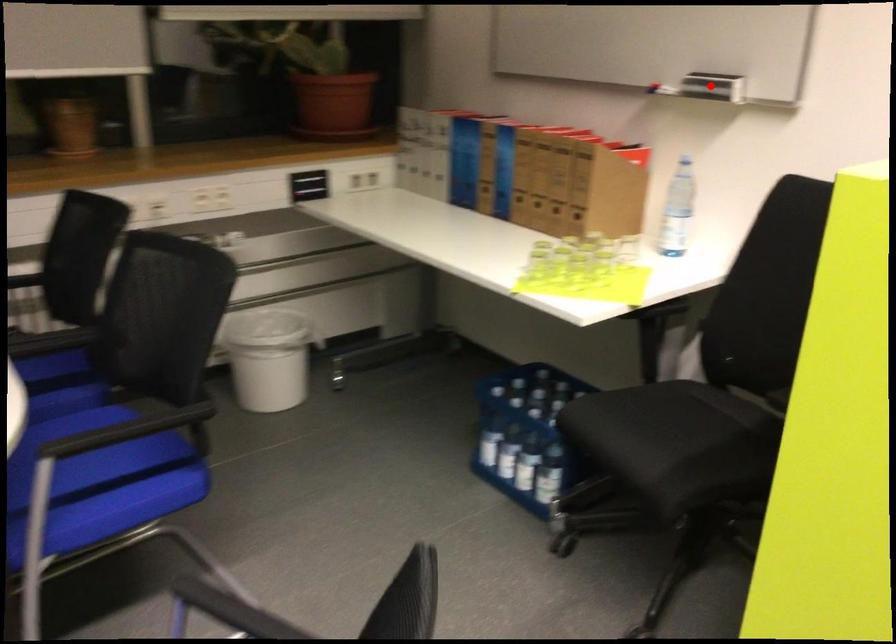
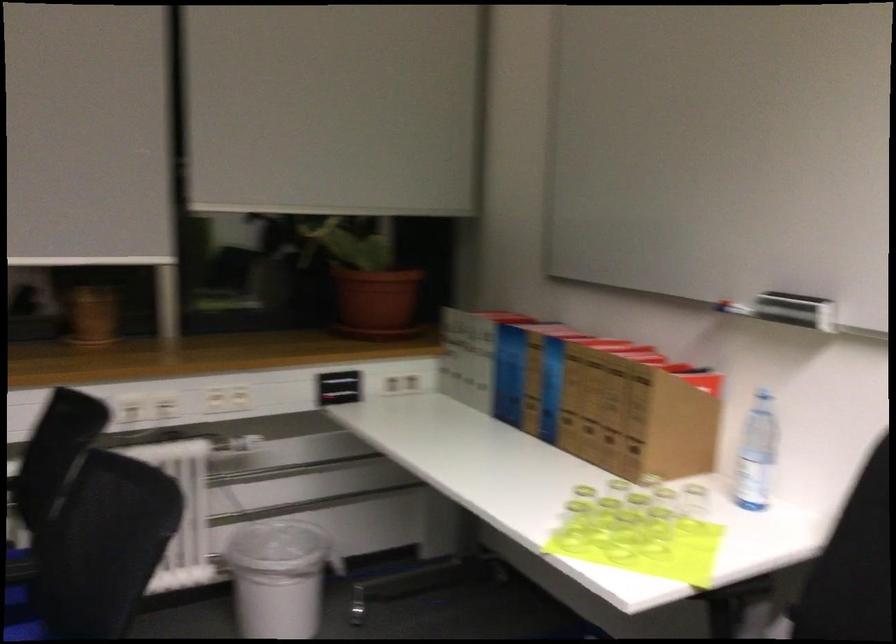
Question: I am providing you with two images of the same scene from different viewpoints. In image1, a red point is highlighted. Considering the same 3D point in image2, which of the following is correct?

Choices:
 (A) It is closer
 (B) It is farther

Answer: (A)